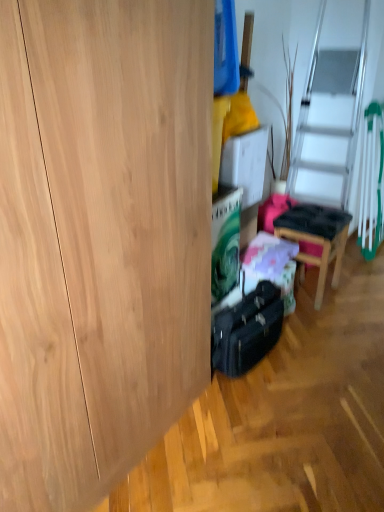
Image resolution: width=384 pixels, height=512 pixels. Describe the element at coordinates (316, 238) in the screenshot. I see `wooden chair at center` at that location.

Locate an element on the screen. wooden chair at center is located at coordinates (316, 238).

Where is `black hardshell suitcase at center`? black hardshell suitcase at center is located at coordinates (247, 330).

The image size is (384, 512). What do you see at coordinates (247, 330) in the screenshot?
I see `black hardshell suitcase at center` at bounding box center [247, 330].

Find the location of a particular element. Image resolution: width=384 pixels, height=512 pixels. wooden chair at center is located at coordinates (316, 238).

Considering the positions of objects wooden chair at center and black hardshell suitcase at center in the image provided, who is more to the right, wooden chair at center or black hardshell suitcase at center?

From the viewer's perspective, wooden chair at center appears more on the right side.

Is wooden chair at center behind black hardshell suitcase at center?

Yes, wooden chair at center is further from the viewer.

Does point (320, 294) come in front of point (255, 294)?

No, (320, 294) is behind (255, 294).

From the image's perspective, is wooden chair at center located above black hardshell suitcase at center?

Yes, from the image's perspective, wooden chair at center is on top of black hardshell suitcase at center.

From a real-world perspective, is wooden chair at center positioned above or below black hardshell suitcase at center?

In terms of real-world spatial position, wooden chair at center is above black hardshell suitcase at center.

Between wooden chair at center and black hardshell suitcase at center, which one has larger width?

wooden chair at center is wider.

From their relative heights in the image, would you say wooden chair at center is taller or shorter than black hardshell suitcase at center?

wooden chair at center is taller than black hardshell suitcase at center.

In the scene shown: Considering the relative sizes of wooden chair at center and black hardshell suitcase at center in the image provided, is wooden chair at center smaller than black hardshell suitcase at center?

No, wooden chair at center is not smaller than black hardshell suitcase at center.

Is wooden chair at center completely or partially outside of black hardshell suitcase at center?

wooden chair at center is positioned outside black hardshell suitcase at center.

Are wooden chair at center and black hardshell suitcase at center beside each other?

No.

Is wooden chair at center positioned with its back to black hardshell suitcase at center?

No.

Can you tell me how much wooden chair at center and black hardshell suitcase at center differ in facing direction?

wooden chair at center and black hardshell suitcase at center are facing 3.85 degrees away from each other.

How distant is wooden chair at center from black hardshell suitcase at center?

wooden chair at center is 62.30 centimeters away from black hardshell suitcase at center.

This screenshot has height=512, width=384. Find the location of `chair above the black hardshell suitcase at center (from a real-world perspective)`. chair above the black hardshell suitcase at center (from a real-world perspective) is located at coordinates (316, 238).

Considering the positions of objects black hardshell suitcase at center and wooden chair at center in the image provided, who is more to the left, black hardshell suitcase at center or wooden chair at center?

black hardshell suitcase at center is more to the left.

Which object is closer to the camera, black hardshell suitcase at center or wooden chair at center?

black hardshell suitcase at center is in front.

Between point (277, 323) and point (304, 255), which one is positioned behind?

Point (304, 255)

From the image's perspective, is black hardshell suitcase at center beneath wooden chair at center?

Yes, from the image's perspective, black hardshell suitcase at center is below wooden chair at center.

From a real-world perspective, which is physically below, black hardshell suitcase at center or wooden chair at center?

From a 3D spatial view, black hardshell suitcase at center is below.

Considering the relative sizes of black hardshell suitcase at center and wooden chair at center in the image provided, is black hardshell suitcase at center thinner than wooden chair at center?

Indeed, black hardshell suitcase at center has a lesser width compared to wooden chair at center.

Is black hardshell suitcase at center taller or shorter than wooden chair at center?

In the image, black hardshell suitcase at center appears to be shorter than wooden chair at center.

Looking at the image, does black hardshell suitcase at center seem bigger or smaller compared to wooden chair at center?

Clearly, black hardshell suitcase at center is smaller in size than wooden chair at center.

Would you say black hardshell suitcase at center is inside or outside wooden chair at center?

black hardshell suitcase at center is outside wooden chair at center.

Is black hardshell suitcase at center placed right next to wooden chair at center?

No, black hardshell suitcase at center is not beside wooden chair at center.

Could you tell me if black hardshell suitcase at center is turned towards wooden chair at center?

No, black hardshell suitcase at center is not aimed at wooden chair at center.

Can you tell me how much black hardshell suitcase at center and wooden chair at center differ in facing direction?

There is a 3.85-degree angle between the facing directions of black hardshell suitcase at center and wooden chair at center.

This screenshot has height=512, width=384. In order to click on luggage on the left of wooden chair at center in this screenshot , I will do `click(247, 330)`.

There is a black hardshell suitcase at center. At what (x,y) coordinates should I click in order to perform the action: click on chair above it (from a real-world perspective). Please return your answer as a coordinate pair (x, y). Looking at the image, I should click on (316, 238).

Identify the location of chair lying above the black hardshell suitcase at center (from the image's perspective). The width and height of the screenshot is (384, 512). (316, 238).